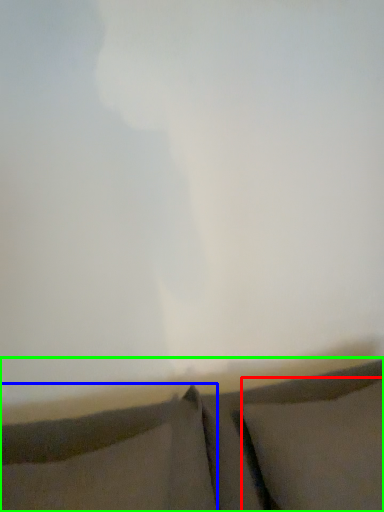
Question: Estimate the real-world distances between objects in this image. Which object is farther from pillow (highlighted by a red box), pillow (highlighted by a blue box) or furniture (highlighted by a green box)?

Choices:
 (A) pillow
 (B) furniture

Answer: (A)